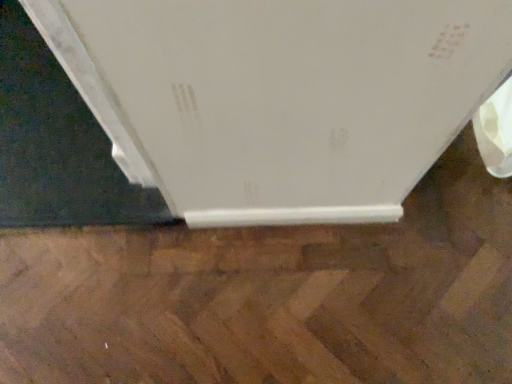
Question: Should I look upward or downward to see brown polished wood at lower center?

Choices:
 (A) up
 (B) down

Answer: (B)